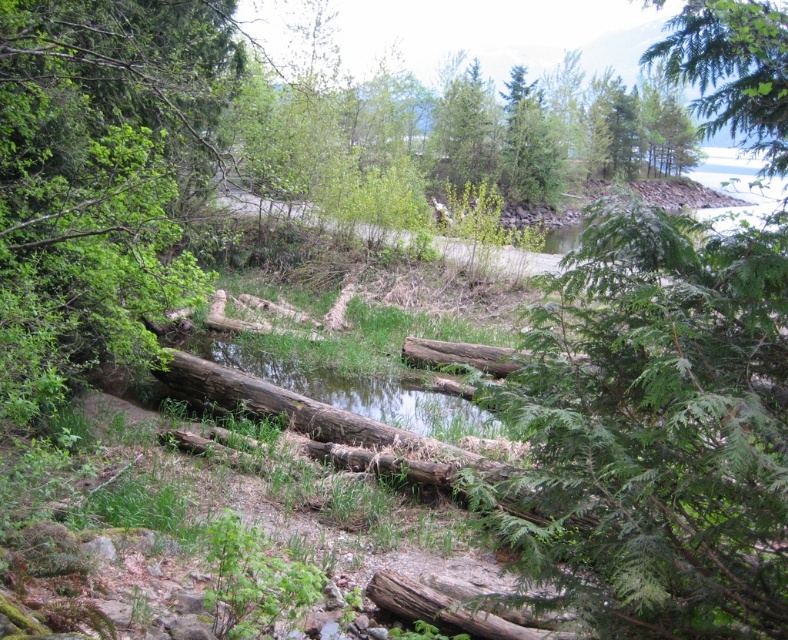
You are a hiker trying to cross the forest area. You see a brown rough log at left and a green leafy tree at upper right. Which object is closer to the ground?

The brown rough log at left is closer to the ground because it is positioned below the green leafy tree at upper right.

You are a hiker who wants to take a shortcut through the forest. You see the brown rough log at left and the green leafy tree at upper right. Which object is closer to you as you stand at the starting point?

The brown rough log at left is closer to you because it is further to the viewer than the green leafy tree at upper right, meaning it appears nearer in the scene.

You are standing in the forest scene and want to place a small flag at the point closer to you between the two points marked as point (6, 406) and point (786, 77). Which point should you choose?

You should choose point (6, 406) because it is closer to you than point (786, 77).